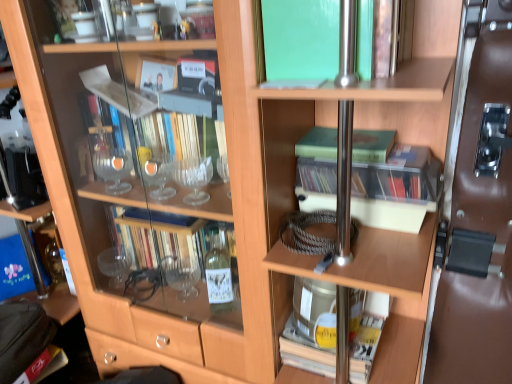
I want to click on vacant space situated above green matte book at center, acting as the 2th book starting from the top (from a real-world perspective), so click(354, 135).